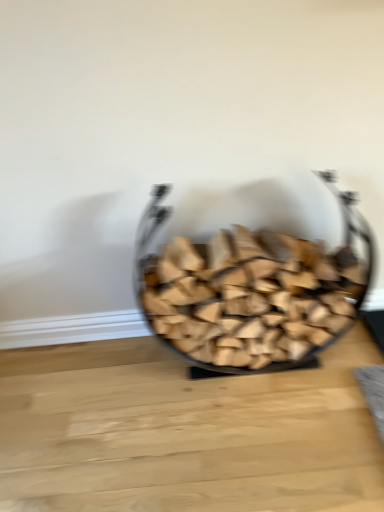
Locate an element on the screen. natural wood table at center is located at coordinates (185, 433).

The width and height of the screenshot is (384, 512). Describe the element at coordinates (185, 433) in the screenshot. I see `natural wood table at center` at that location.

Measure the distance between wooden logs at center and camera.

1.15 meters.

What do you see at coordinates (253, 281) in the screenshot?
I see `wooden logs at center` at bounding box center [253, 281].

This screenshot has width=384, height=512. What are the coordinates of `wooden logs at center` in the screenshot? It's located at pyautogui.click(x=253, y=281).

Find the location of a particular element. This screenshot has width=384, height=512. natural wood table at center is located at coordinates (185, 433).

Considering the relative positions of wooden logs at center and natural wood table at center in the image provided, is wooden logs at center to the left of natural wood table at center from the viewer's perspective?

No, wooden logs at center is not to the left of natural wood table at center.

Is wooden logs at center positioned behind natural wood table at center?

No, it is in front of natural wood table at center.

Is point (181, 246) farther from camera compared to point (51, 505)?

Yes, it is behind point (51, 505).

From the image's perspective, would you say wooden logs at center is positioned over natural wood table at center?

Yes.

From a real-world perspective, is wooden logs at center below natural wood table at center?

Incorrect, from a real-world perspective, wooden logs at center is higher than natural wood table at center.

From the picture: Is wooden logs at center wider than natural wood table at center?

Incorrect, the width of wooden logs at center does not surpass that of natural wood table at center.

Looking at this image, between wooden logs at center and natural wood table at center, which one has less height?

With less height is natural wood table at center.

Based on the photo, between wooden logs at center and natural wood table at center, which one has smaller size?

natural wood table at center is smaller.

Is wooden logs at center inside the boundaries of natural wood table at center, or outside?

wooden logs at center exists outside the volume of natural wood table at center.

Is wooden logs at center with natural wood table at center?

wooden logs at center and natural wood table at center are clearly separated.

Is wooden logs at center positioned with its back to natural wood table at center?

No, natural wood table at center is not at the back of wooden logs at center.

From the picture: Can you tell me how much wooden logs at center and natural wood table at center differ in facing direction?

The angle between the facing direction of wooden logs at center and the facing direction of natural wood table at center is 179 degrees.

How far apart are wooden logs at center and natural wood table at center?

wooden logs at center is 12.65 inches away from natural wood table at center.

Identify the location of tableware in front of the natural wood table at center. The width and height of the screenshot is (384, 512). (253, 281).

Can you confirm if natural wood table at center is positioned to the right of wooden logs at center?

No, natural wood table at center is not to the right of wooden logs at center.

Is the position of natural wood table at center more distant than that of wooden logs at center?

Yes.

Between point (71, 431) and point (226, 249), which one is positioned in front?

Positioned in front is point (226, 249).

From the image's perspective, relative to wooden logs at center, is natural wood table at center above or below?

natural wood table at center is below wooden logs at center.

From a real-world perspective, is natural wood table at center located higher than wooden logs at center?

No, from a real-world perspective, natural wood table at center is not over wooden logs at center

Which of these two, natural wood table at center or wooden logs at center, is wider?

natural wood table at center is wider.

Who is taller, natural wood table at center or wooden logs at center?

wooden logs at center is taller.

Is natural wood table at center bigger than wooden logs at center?

No, natural wood table at center is not bigger than wooden logs at center.

Would you say natural wood table at center is outside wooden logs at center?

Yes.

Are natural wood table at center and wooden logs at center located far from each other?

They are positioned close to each other.

Is natural wood table at center turned away from wooden logs at center?

No.

What's the angular difference between natural wood table at center and wooden logs at center's facing directions?

natural wood table at center and wooden logs at center are facing 179 degrees away from each other.

Where is `tableware that appears on the right of natural wood table at center`? This screenshot has height=512, width=384. tableware that appears on the right of natural wood table at center is located at coordinates (253, 281).

The height and width of the screenshot is (512, 384). I want to click on tableware located above the natural wood table at center (from the image's perspective), so click(x=253, y=281).

Find the location of a particular element. The image size is (384, 512). table top on the left side of wooden logs at center is located at coordinates (185, 433).